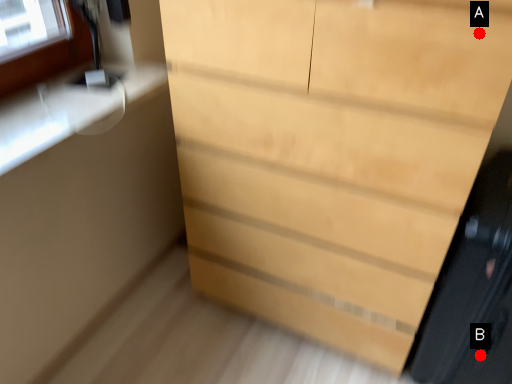
Question: Two points are circled on the image, labeled by A and B beside each circle. Which of the following is the farthest from the observer?

Choices:
 (A) A is further
 (B) B is further

Answer: (B)